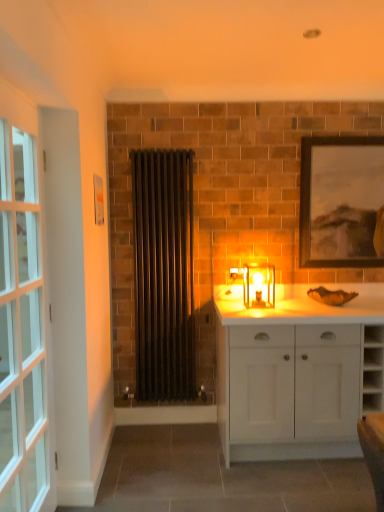
Find the location of a particular element. The image size is (384, 512). blank space situated above wooden framed artwork at upper right (from a real-world perspective) is located at coordinates pos(352,129).